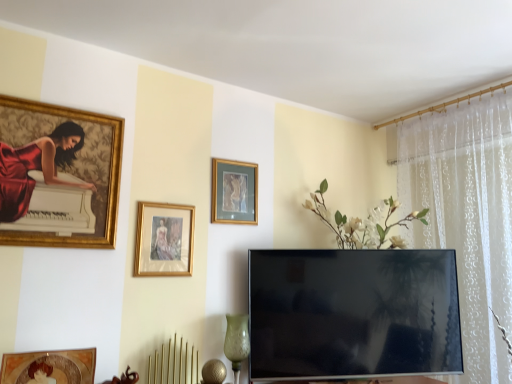
Find the location of `green textured glass vase at lower center`. green textured glass vase at lower center is located at coordinates (237, 342).

The image size is (512, 384). Find the location of `gold-framed painting at upper left, which ranks as the first picture frame in front-to-back order`. gold-framed painting at upper left, which ranks as the first picture frame in front-to-back order is located at coordinates (58, 175).

This screenshot has height=384, width=512. What do you see at coordinates (353, 313) in the screenshot? I see `flat screen tv at center` at bounding box center [353, 313].

Measure the distance between flat screen tv at center and camera.

The distance of flat screen tv at center from camera is 2.04 meters.

Consider the image. How much space does gold-framed picture at center, positioned as the 1th picture frame in right-to-left order, occupy horizontally?

gold-framed picture at center, positioned as the 1th picture frame in right-to-left order, is 1.58 inches wide.

This screenshot has height=384, width=512. Describe the element at coordinates (164, 239) in the screenshot. I see `gold-framed picture at center, the 2th picture frame viewed from the front` at that location.

Locate an element on the screen. Image resolution: width=512 pixels, height=384 pixels. green textured glass vase at lower center is located at coordinates (237, 342).

Choose the correct answer: Is flat screen tv at center inside gold-framed picture at center, which is the 1th picture frame from back to front, or outside it?

flat screen tv at center is located beyond the bounds of gold-framed picture at center, which is the 1th picture frame from back to front.

Considering the positions of objects flat screen tv at center and gold-framed picture at center, acting as the 3th picture frame starting from the front, in the image provided, who is behind, flat screen tv at center or gold-framed picture at center, acting as the 3th picture frame starting from the front,?

Positioned behind is gold-framed picture at center, acting as the 3th picture frame starting from the front.

From a real-world perspective, does flat screen tv at center stand above gold-framed picture at center, which is the 1th picture frame from back to front?

No, from a real-world perspective, flat screen tv at center is not on top of gold-framed picture at center, which is the 1th picture frame from back to front.

Can you confirm if flat screen tv at center is wider than gold-framed picture at center, which is the 1th picture frame from back to front?

Yes.

Based on the photo, from a real-world perspective, relative to gold-framed picture at center, positioned as the 1th picture frame in right-to-left order, is gold-framed picture at center, positioned as the 2th picture frame in back-to-front order, vertically above or below?

gold-framed picture at center, positioned as the 2th picture frame in back-to-front order, is situated lower than gold-framed picture at center, positioned as the 1th picture frame in right-to-left order, in the real world.

Would you say gold-framed picture at center, positioned as the second picture frame in left-to-right order, is a long distance from gold-framed picture at center, which is the 1th picture frame from back to front?

No, gold-framed picture at center, positioned as the second picture frame in left-to-right order, is not far away from gold-framed picture at center, which is the 1th picture frame from back to front.

Which is correct: gold-framed picture at center, positioned as the second picture frame in left-to-right order, is inside gold-framed picture at center, acting as the 3th picture frame starting from the front, or outside of it?

gold-framed picture at center, positioned as the second picture frame in left-to-right order, is not enclosed by gold-framed picture at center, acting as the 3th picture frame starting from the front.

Considering the points (148, 267) and (243, 194), which point is behind, point (148, 267) or point (243, 194)?

Positioned behind is point (243, 194).

Is green textured glass vase at lower center surrounding gold-framed picture at center, marked as the second picture frame in a right-to-left arrangement?

No, gold-framed picture at center, marked as the second picture frame in a right-to-left arrangement, is not a part of green textured glass vase at lower center.

From the image's perspective, which is below, green textured glass vase at lower center or gold-framed picture at center, positioned as the 2th picture frame in back-to-front order?

green textured glass vase at lower center is shown below in the image.

From the picture: Does green textured glass vase at lower center appear on the right side of gold-framed picture at center, positioned as the second picture frame in left-to-right order?

Yes, green textured glass vase at lower center is to the right of gold-framed picture at center, positioned as the second picture frame in left-to-right order.

Where is `glass vase below the gold-framed picture at center, positioned as the second picture frame in left-to-right order (from a real-world perspective)`? glass vase below the gold-framed picture at center, positioned as the second picture frame in left-to-right order (from a real-world perspective) is located at coordinates coord(237,342).

Considering the positions of objects flat screen tv at center and gold-framed picture at center, positioned as the second picture frame in left-to-right order, in the image provided, who is more to the left, flat screen tv at center or gold-framed picture at center, positioned as the second picture frame in left-to-right order,?

gold-framed picture at center, positioned as the second picture frame in left-to-right order.

Considering the relative sizes of flat screen tv at center and gold-framed picture at center, marked as the second picture frame in a right-to-left arrangement, in the image provided, is flat screen tv at center taller than gold-framed picture at center, marked as the second picture frame in a right-to-left arrangement,?

Yes.

Is flat screen tv at center positioned with its back to gold-framed picture at center, the 2th picture frame viewed from the front?

No, gold-framed picture at center, the 2th picture frame viewed from the front, is not at the back of flat screen tv at center.

Locate an element on the screen. The height and width of the screenshot is (384, 512). television below the gold-framed picture at center, positioned as the 2th picture frame in back-to-front order (from a real-world perspective) is located at coordinates (353, 313).

Between gold-framed picture at center, the 2th picture frame viewed from the front, and gold-framed painting at upper left, the third picture frame positioned from the back, which one appears on the right side from the viewer's perspective?

gold-framed picture at center, the 2th picture frame viewed from the front.

Do you think gold-framed picture at center, positioned as the second picture frame in left-to-right order, is within gold-framed painting at upper left, the 1th picture frame in the left-to-right sequence, or outside of it?

gold-framed picture at center, positioned as the second picture frame in left-to-right order, lies outside gold-framed painting at upper left, the 1th picture frame in the left-to-right sequence.

Which of these two, gold-framed picture at center, marked as the second picture frame in a right-to-left arrangement, or gold-framed painting at upper left, the third picture frame positioned from the back, is thinner?

gold-framed picture at center, marked as the second picture frame in a right-to-left arrangement.

Does point (179, 260) appear closer or farther from the camera than point (111, 232)?

Point (179, 260) appears to be farther away from the viewer than point (111, 232).

Is point (4, 126) positioned behind point (228, 189)?

No, (4, 126) is closer to viewer.

Considering the sizes of objects gold-framed painting at upper left, the 1th picture frame in the left-to-right sequence, and gold-framed picture at center, the third picture frame viewed from the left, in the image provided, who is smaller, gold-framed painting at upper left, the 1th picture frame in the left-to-right sequence, or gold-framed picture at center, the third picture frame viewed from the left,?

gold-framed picture at center, the third picture frame viewed from the left.

Relative to gold-framed picture at center, the third picture frame viewed from the left, is gold-framed painting at upper left, the third picture frame positioned from the back, in front or behind?

Visually, gold-framed painting at upper left, the third picture frame positioned from the back, is located in front of gold-framed picture at center, the third picture frame viewed from the left.

Between gold-framed painting at upper left, the 1th picture frame in the left-to-right sequence, and gold-framed picture at center, which is the 1th picture frame from back to front, which one appears on the right side from the viewer's perspective?

Positioned to the right is gold-framed picture at center, which is the 1th picture frame from back to front.

From a real-world perspective, is green textured glass vase at lower center physically below flat screen tv at center?

Yes, from a real-world perspective, green textured glass vase at lower center is beneath flat screen tv at center.

You are a GUI agent. You are given a task and a screenshot of the screen. Output one action in this format:
    pyautogui.click(x=<x>, y=<y>)
    Task: Click on the glass vase in front of the flat screen tv at center
    The height and width of the screenshot is (384, 512).
    Given the screenshot: What is the action you would take?
    pyautogui.click(x=237, y=342)

Is point (240, 334) more distant than point (398, 254)?

That is False.

Is green textured glass vase at lower center positioned with its back to flat screen tv at center?

green textured glass vase at lower center does not have its back to flat screen tv at center.

Find the location of a particular element. The height and width of the screenshot is (384, 512). television below the gold-framed picture at center, positioned as the 1th picture frame in right-to-left order (from a real-world perspective) is located at coordinates (353, 313).

Locate an element on the screen. This screenshot has height=384, width=512. picture frame that is the 2nd object above the gold-framed picture at center, positioned as the second picture frame in left-to-right order (from a real-world perspective) is located at coordinates (234, 192).

In the scene shown: Which object lies further to the anchor point flat screen tv at center, green textured glass vase at lower center or gold-framed picture at center, which is the 1th picture frame from back to front?

gold-framed picture at center, which is the 1th picture frame from back to front.

Which object lies further to the anchor point gold-framed picture at center, positioned as the second picture frame in left-to-right order, flat screen tv at center or gold-framed picture at center, which is the 1th picture frame from back to front?

flat screen tv at center.

Based on their spatial positions, is gold-framed picture at center, positioned as the 2th picture frame in back-to-front order, or green textured glass vase at lower center closer to gold-framed painting at upper left, the 1th picture frame in the left-to-right sequence?

gold-framed picture at center, positioned as the 2th picture frame in back-to-front order, is closer to gold-framed painting at upper left, the 1th picture frame in the left-to-right sequence.

When comparing their distances from gold-framed picture at center, positioned as the 2th picture frame in back-to-front order, does green textured glass vase at lower center or flat screen tv at center seem closer?

Based on the image, green textured glass vase at lower center appears to be nearer to gold-framed picture at center, positioned as the 2th picture frame in back-to-front order.

From the image, which object appears to be farther from gold-framed painting at upper left, which ranks as the first picture frame in front-to-back order, gold-framed picture at center, acting as the 3th picture frame starting from the front, or green textured glass vase at lower center?

Based on the image, green textured glass vase at lower center appears to be further to gold-framed painting at upper left, which ranks as the first picture frame in front-to-back order.

When comparing their distances from gold-framed picture at center, acting as the 3th picture frame starting from the front, does gold-framed picture at center, positioned as the second picture frame in left-to-right order, or flat screen tv at center seem further?

flat screen tv at center.

Which object lies nearer to the anchor point gold-framed picture at center, which is the 1th picture frame from back to front, gold-framed picture at center, the 2th picture frame viewed from the front, or gold-framed painting at upper left, arranged as the third picture frame when viewed from the right?

gold-framed picture at center, the 2th picture frame viewed from the front.

From the picture: From the image, which object appears to be farther from green textured glass vase at lower center, flat screen tv at center or gold-framed painting at upper left, the 1th picture frame in the left-to-right sequence?

Among the two, gold-framed painting at upper left, the 1th picture frame in the left-to-right sequence, is located further to green textured glass vase at lower center.

Find the location of `television between gold-framed picture at center, the third picture frame viewed from the left, and green textured glass vase at lower center from top to bottom`. television between gold-framed picture at center, the third picture frame viewed from the left, and green textured glass vase at lower center from top to bottom is located at coordinates (353, 313).

Identify the location of picture frame that lies between gold-framed picture at center, acting as the 3th picture frame starting from the front, and green textured glass vase at lower center from top to bottom. This screenshot has height=384, width=512. (164, 239).

In order to click on glass vase between gold-framed picture at center, positioned as the second picture frame in left-to-right order, and flat screen tv at center, in the horizontal direction in this screenshot , I will do `click(237, 342)`.

Image resolution: width=512 pixels, height=384 pixels. I want to click on glass vase situated between gold-framed painting at upper left, the third picture frame positioned from the back, and flat screen tv at center from left to right, so click(x=237, y=342).